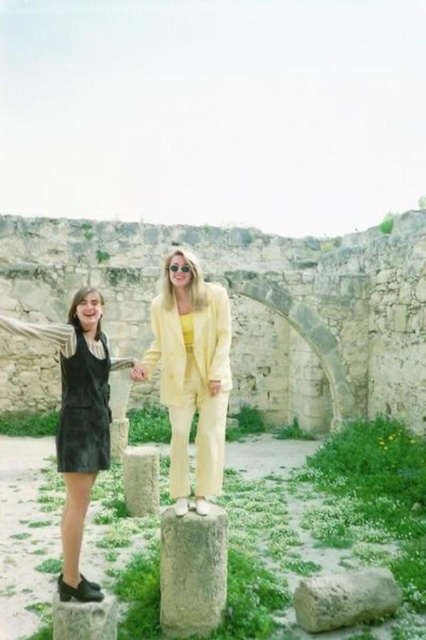
You are an artist trying to sketch the scene. You notice the leather dress at left and the pink fabric hand at center. Which object should you draw first if you want to capture the larger object first?

The leather dress at left is bigger than the pink fabric hand at center, so you should draw the leather dress at left first to capture the larger object first.

You are a photographer trying to capture a photo of the velvet black dress at left and the smooth gray stone at lower left in the same frame. Given that your camera has a maximum focal length of 5 meters, will you be able to include both objects in the photo without moving closer?

The velvet black dress at left and the smooth gray stone at lower left are 7.03 meters apart. Since the camera can only focus up to 5 meters, it won not be able to capture both objects in the same frame without moving closer.

You are standing at the point marked as point (x=255, y=305) in the image. What object is located exactly at this point?

The stone archway at center is located exactly at point (x=255, y=305).